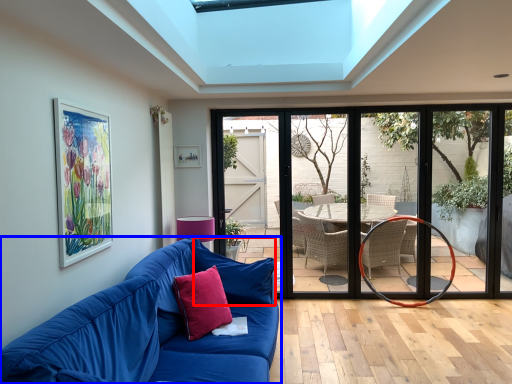
Question: Which object is closer to the camera taking this photo, pillow (highlighted by a red box) or studio couch (highlighted by a blue box)?

Choices:
 (A) pillow
 (B) studio couch

Answer: (B)